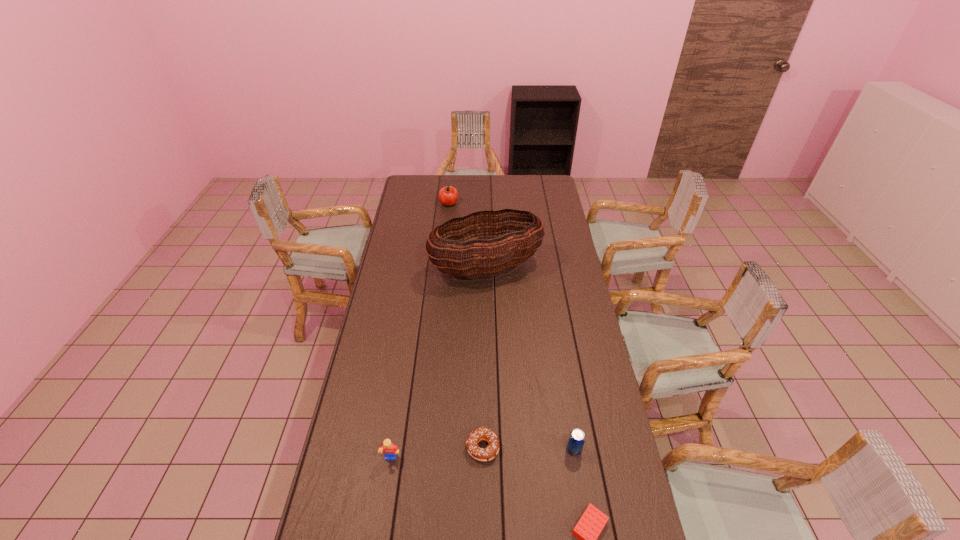
At what (x,y) coordinates should I click in order to perform the action: click on empty location between the leftmost object and the second shortest object. Please return your answer as a coordinate pair (x, y). The height and width of the screenshot is (540, 960). Looking at the image, I should click on (437, 454).

At what (x,y) coordinates should I click in order to perform the action: click on vacant area that lies between the doughnut and the tallest object. Please return your answer as a coordinate pair (x, y). Looking at the image, I should click on (485, 358).

Identify the location of vacant space in between the beer can and the farthest object. Image resolution: width=960 pixels, height=540 pixels. (512, 326).

Find the location of a particular element. The height and width of the screenshot is (540, 960). vacant space in between the fifth nearest object and the taller Lego is located at coordinates (439, 364).

Locate which object is the third closest to the basket. Please provide its 2D coordinates. Your answer should be formatted as a tuple, i.e. [(x, y)], where the tuple contains the x and y coordinates of a point satisfying the conditions above.

[(576, 440)]

Point out which object is positioned as the fourth nearest to the right Lego. Please provide its 2D coordinates. Your answer should be formatted as a tuple, i.e. [(x, y)], where the tuple contains the x and y coordinates of a point satisfying the conditions above.

[(475, 257)]

Image resolution: width=960 pixels, height=540 pixels. What are the coordinates of `vacant area that satisfies the following two spatial constraints: 1. on the front side of the second farthest object; 2. on the left side of the beer can` in the screenshot? It's located at (489, 449).